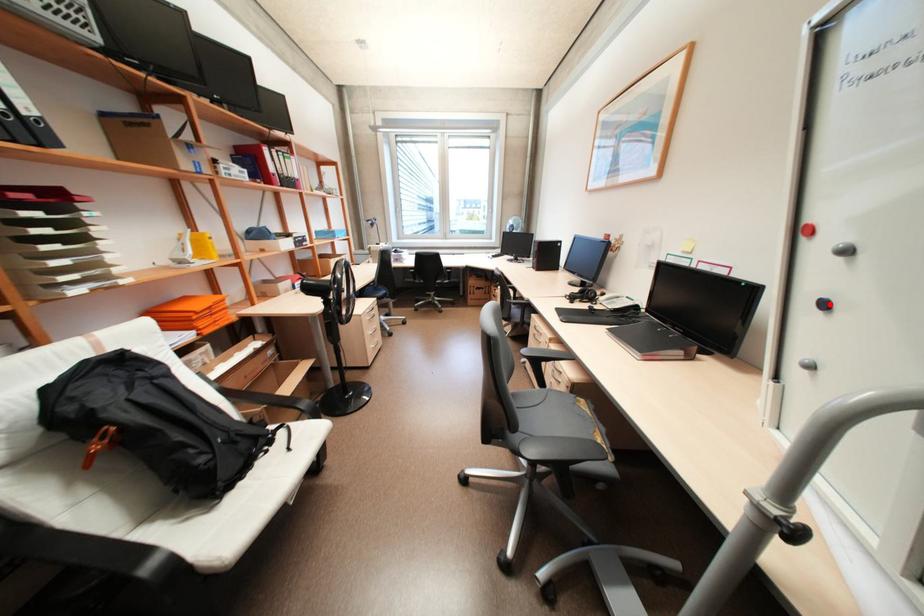
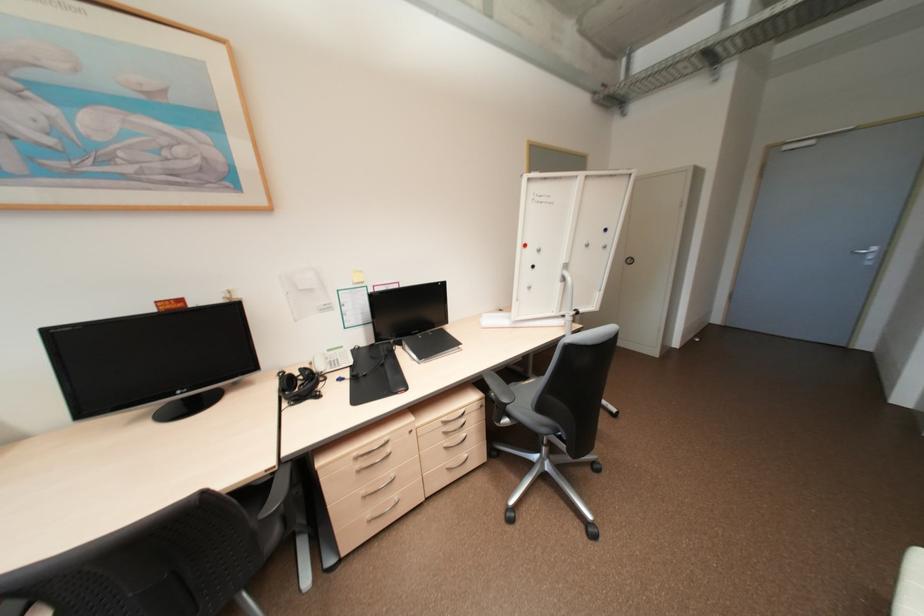
In the second image, find the point that corresponds to the highlighted location in the first image.

(539, 265)